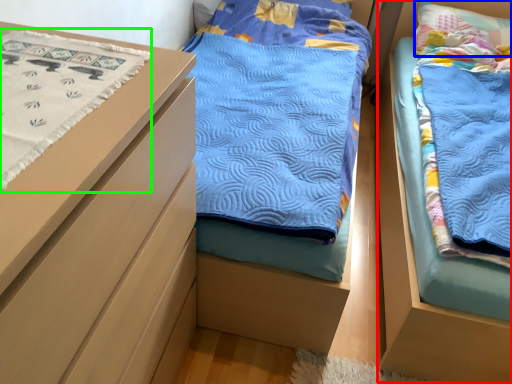
Question: Which object is positioned closest to bed (highlighted by a red box)? Select from pillow (highlighted by a blue box) and blanket (highlighted by a green box).

Choices:
 (A) pillow
 (B) blanket

Answer: (B)